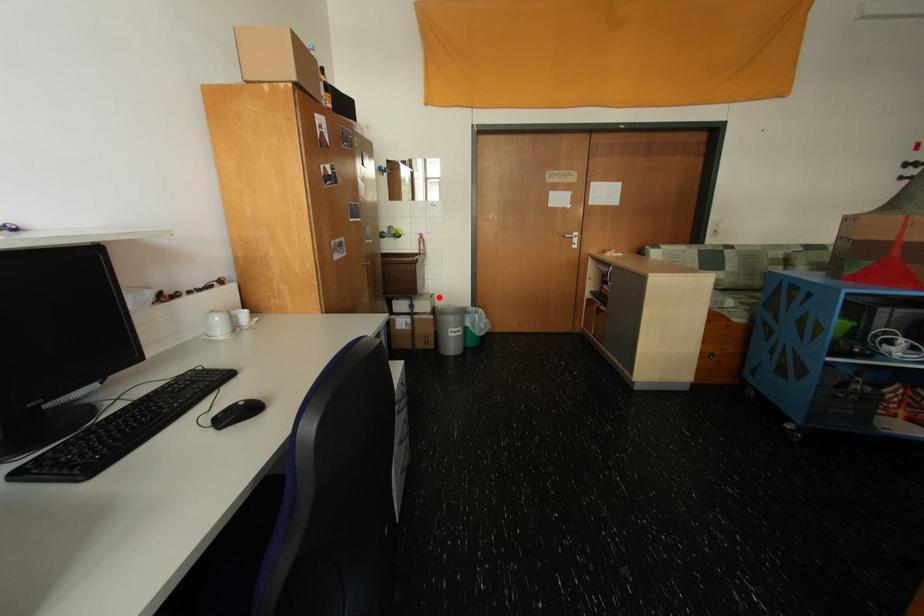
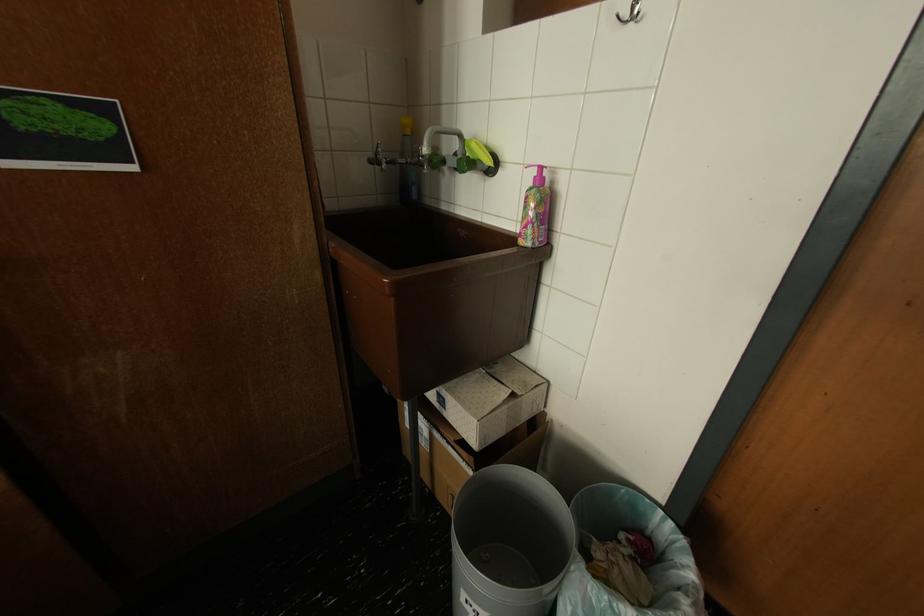
Locate, in the second image, the point that corresponds to the highlighted location in the first image.

(508, 402)